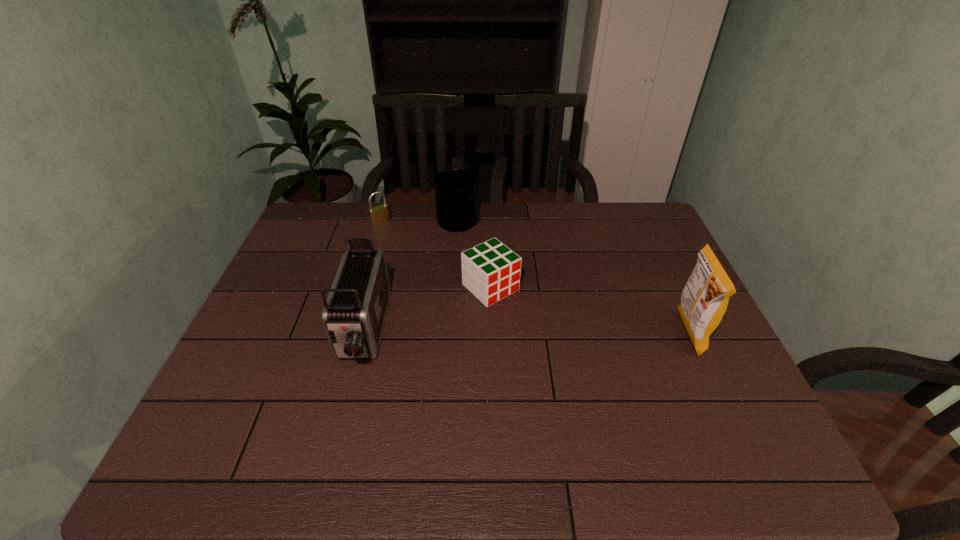
This screenshot has height=540, width=960. I want to click on free spot on the desktop that is between the camcorder and the rightmost object and is positioned on the front-facing side of the padlock, so click(500, 332).

Locate an element on the screen. The width and height of the screenshot is (960, 540). free spot on the desktop that is between the camcorder and the crisp (potato chip) and is positioned on the red face of the cube is located at coordinates (541, 332).

Identify the location of free space on the desktop that is between the camcorder and the rightmost object and is positioned on the side of the mug with the handle. click(x=571, y=333).